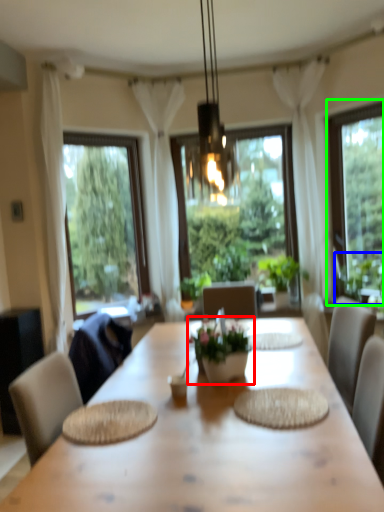
Question: Considering the real-world distances, which object is farthest from houseplant (highlighted by a red box)? plant (highlighted by a blue box) or window (highlighted by a green box)?

Choices:
 (A) plant
 (B) window

Answer: (B)